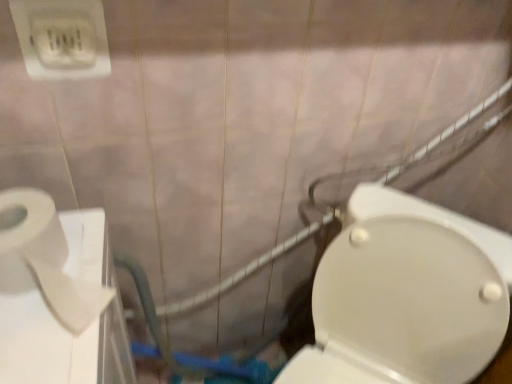
Question: Would you say white plastic outlet at upper left is inside or outside white matte toilet paper at left?

Choices:
 (A) outside
 (B) inside

Answer: (A)

Question: From a real-world perspective, relative to white matte toilet paper at left, is white plastic outlet at upper left vertically above or below?

Choices:
 (A) above
 (B) below

Answer: (A)

Question: Based on their relative distances, which object is farther from the white glossy toilet at center right?

Choices:
 (A) white plastic outlet at upper left
 (B) white matte toilet paper at left

Answer: (A)

Question: Which object is the farthest from the white glossy toilet at center right?

Choices:
 (A) white matte toilet paper at left
 (B) white plastic outlet at upper left

Answer: (B)